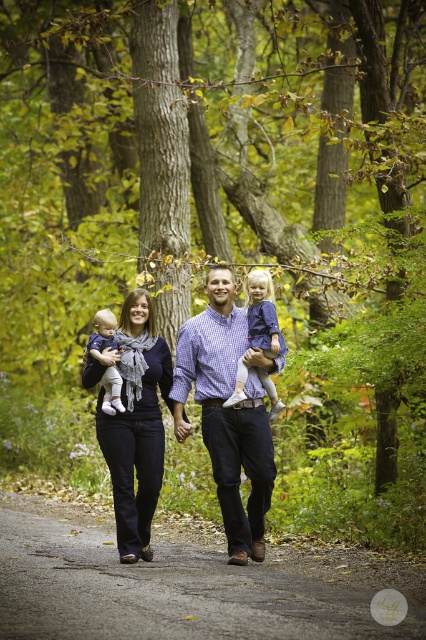
Question: Which object appears farthest from the camera in this image?

Choices:
 (A) soft white fabric baby at center
 (B) gray asphalt road at center

Answer: (A)

Question: Is gray asphalt road at center positioned at the back of matte blue dress at center?

Choices:
 (A) yes
 (B) no

Answer: (B)

Question: Is dark blue jeans at center positioned in front of soft white fabric baby at center?

Choices:
 (A) yes
 (B) no

Answer: (A)

Question: Can you confirm if blue checkered shirt at center is positioned to the right of matte blue dress at center?

Choices:
 (A) no
 (B) yes

Answer: (A)

Question: Among these objects, which one is farthest from the camera?

Choices:
 (A) dark blue jeans at center
 (B) soft white fabric baby at center

Answer: (B)

Question: Among these points, which one is nearest to the camera?

Choices:
 (A) (374, 624)
 (B) (244, 548)
 (C) (281, 401)

Answer: (A)